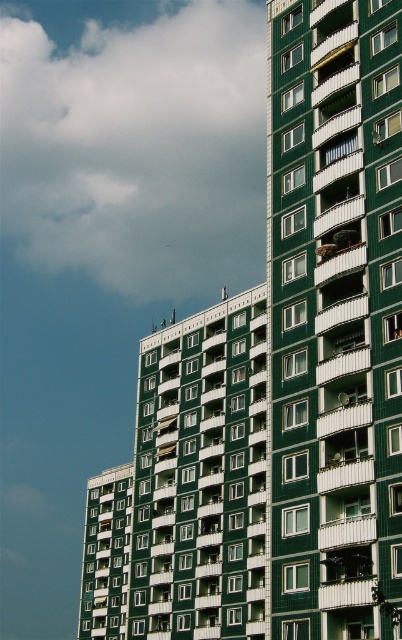
Does green matte building at center appear over cloudy sky at upper left?

No, green matte building at center is not above cloudy sky at upper left.

Can you confirm if green matte building at center is wider than cloudy sky at upper left?

In fact, green matte building at center might be narrower than cloudy sky at upper left.

Identify the location of green matte building at center. (334, 320).

Find the location of a particular element. green matte building at center is located at coordinates point(334,320).